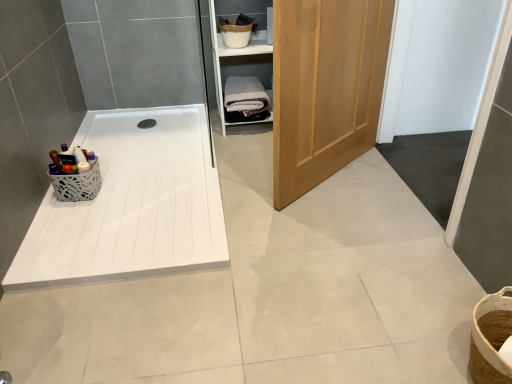
Question: Does black rubber drain at center appear on the left side of wooden cabinet at upper right?

Choices:
 (A) no
 (B) yes

Answer: (B)

Question: Can you confirm if black rubber drain at center is smaller than wooden cabinet at upper right?

Choices:
 (A) no
 (B) yes

Answer: (B)

Question: Is black rubber drain at center turned away from wooden cabinet at upper right?

Choices:
 (A) yes
 (B) no

Answer: (B)

Question: From the image's perspective, is black rubber drain at center under wooden cabinet at upper right?

Choices:
 (A) no
 (B) yes

Answer: (B)

Question: Is black rubber drain at center beside wooden cabinet at upper right?

Choices:
 (A) yes
 (B) no

Answer: (B)

Question: From a real-world perspective, relative to wooden cabinet at upper right, is white lace basket at left vertically above or below?

Choices:
 (A) above
 (B) below

Answer: (B)

Question: Is white lace basket at left in front of or behind wooden cabinet at upper right in the image?

Choices:
 (A) front
 (B) behind

Answer: (A)

Question: Is point (57, 177) closer or farther from the camera than point (263, 36)?

Choices:
 (A) farther
 (B) closer

Answer: (B)

Question: Choose the correct answer: Is white lace basket at left inside wooden cabinet at upper right or outside it?

Choices:
 (A) outside
 (B) inside

Answer: (A)

Question: Considering the positions of light brown wood door at center and black rubber drain at center in the image, is light brown wood door at center bigger or smaller than black rubber drain at center?

Choices:
 (A) small
 (B) big

Answer: (B)

Question: Considering their positions, is light brown wood door at center located in front of or behind black rubber drain at center?

Choices:
 (A) front
 (B) behind

Answer: (A)

Question: Choose the correct answer: Is light brown wood door at center inside black rubber drain at center or outside it?

Choices:
 (A) outside
 (B) inside

Answer: (A)

Question: Is light brown wood door at center to the left or to the right of black rubber drain at center in the image?

Choices:
 (A) left
 (B) right

Answer: (B)

Question: Is wooden cabinet at upper right bigger or smaller than white lace basket at left?

Choices:
 (A) small
 (B) big

Answer: (B)

Question: Is wooden cabinet at upper right situated inside white lace basket at left or outside?

Choices:
 (A) outside
 (B) inside

Answer: (A)